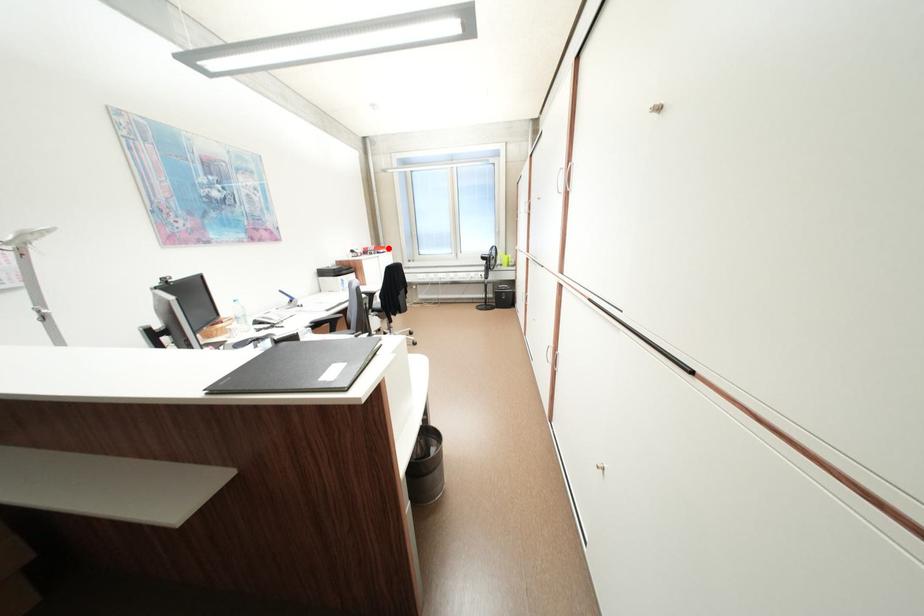
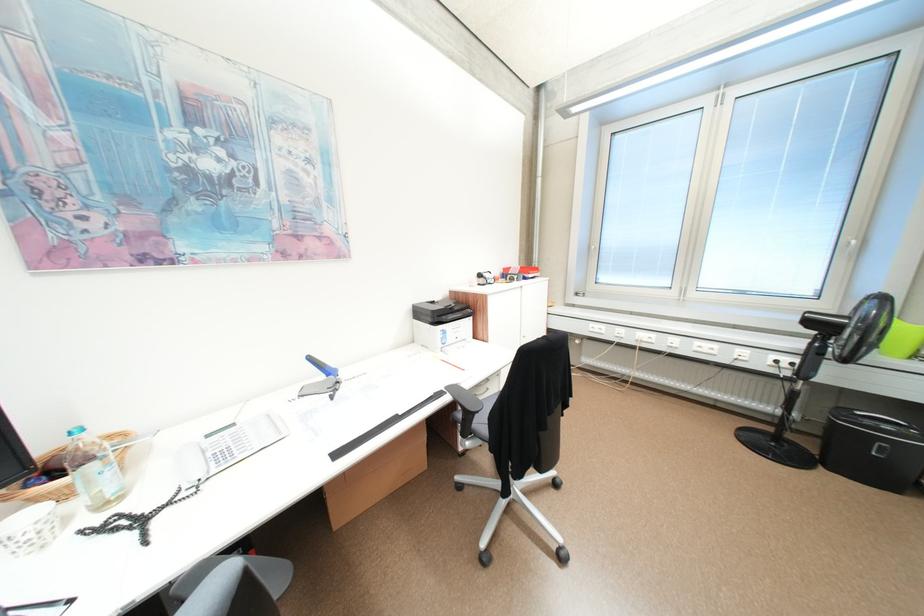
The point at the highlighted location is marked in the first image. Where is the corresponding point in the second image?

(538, 269)